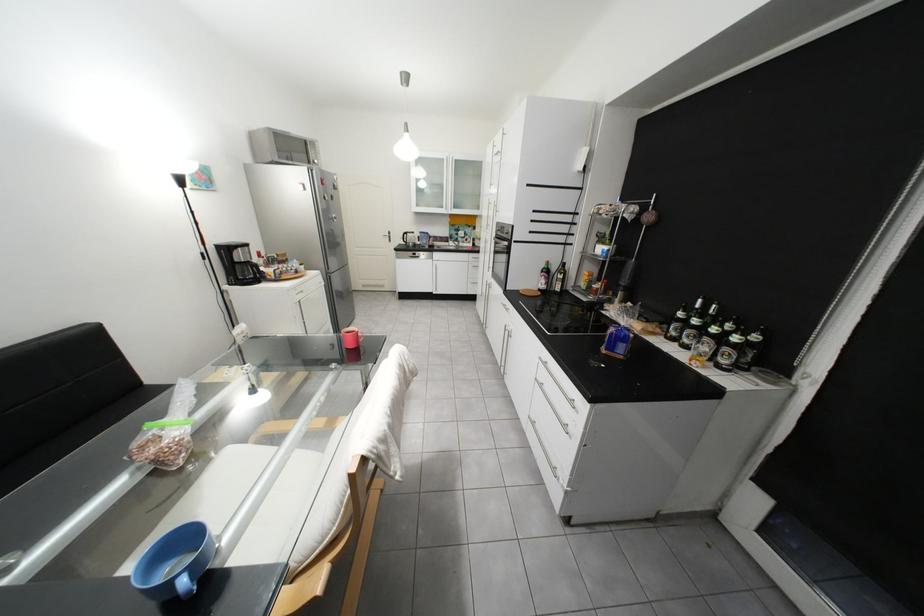
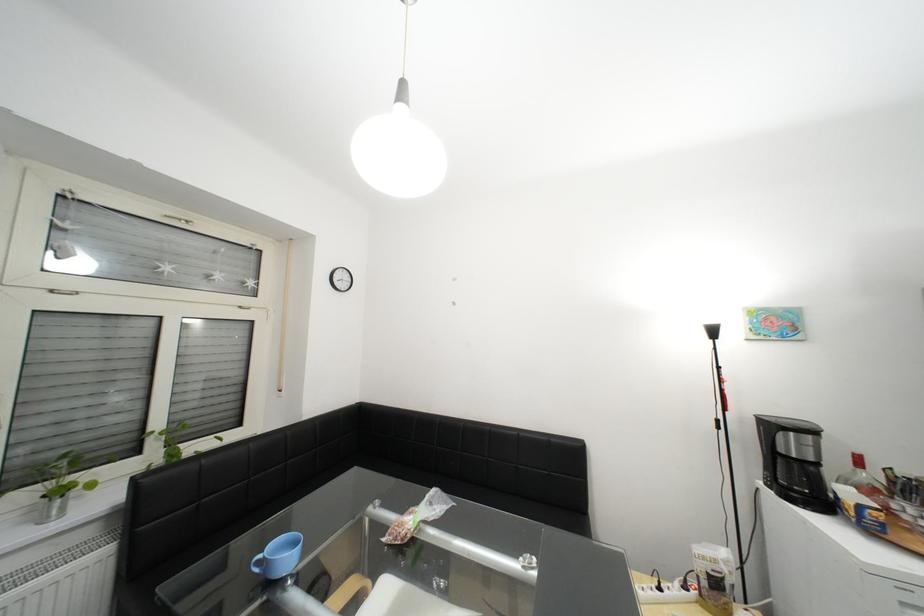
Locate, in the second image, the point that corresponds to pixel 237 251 in the first image.

(782, 428)